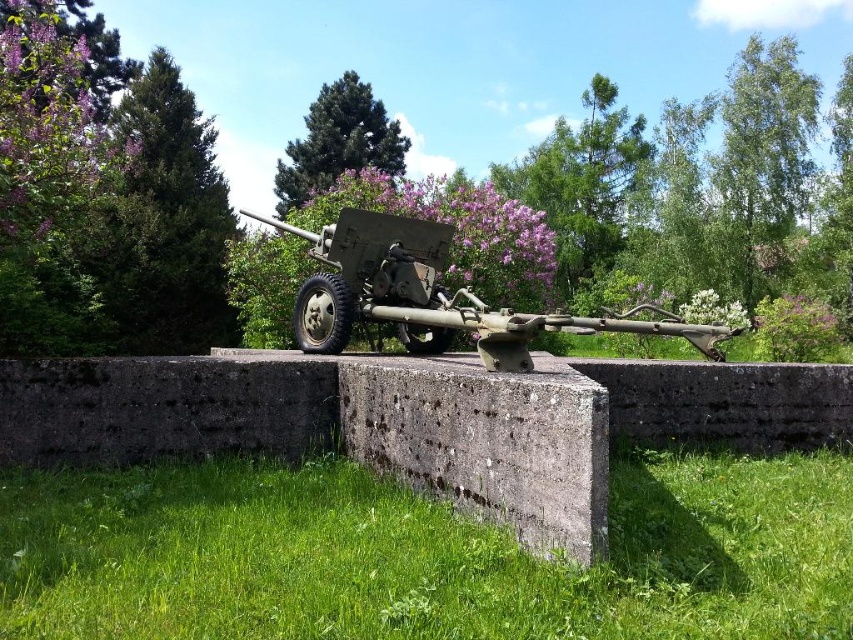
You are a photographer aiming to capture the matte green cannon at center in your shot. There is a green textured pine tree at upper left that might obstruct the view. Based on their positions, will the pine tree block the cannon from being fully visible?

The green textured pine tree at upper left is above the matte green cannon at center, so it will block part of the cannon from being fully visible.

You are a drone operator trying to land a drone on the green grass at lower center. What are the coordinates you should input into the drone to ensure a safe landing?

The coordinates for the green grass at lower center are at point [422,554], so you should input those coordinates into the drone to ensure a safe landing.